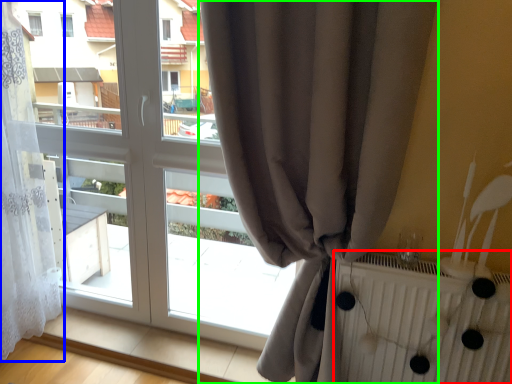
Question: Considering the real-world distances, which object is farthest from radiator (highlighted by a red box)? curtain (highlighted by a blue box) or curtain (highlighted by a green box)?

Choices:
 (A) curtain
 (B) curtain

Answer: (A)